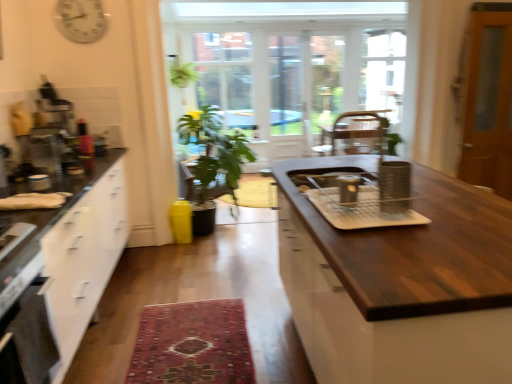
Where is `free space above carpeted rug at center (from a real-world perspective)`? free space above carpeted rug at center (from a real-world perspective) is located at coordinates (186, 337).